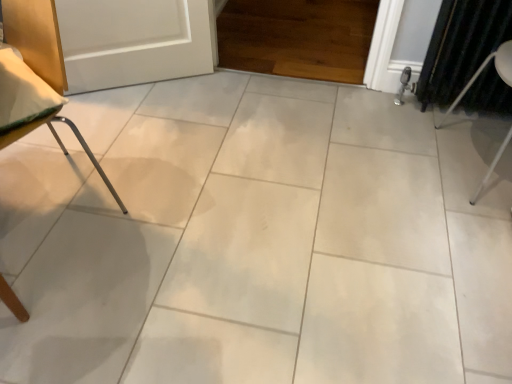
Where is `free spot below white metal chair at right, the first furniture positioned from the right (from a real-world perspective)`? This screenshot has height=384, width=512. free spot below white metal chair at right, the first furniture positioned from the right (from a real-world perspective) is located at coordinates (479, 157).